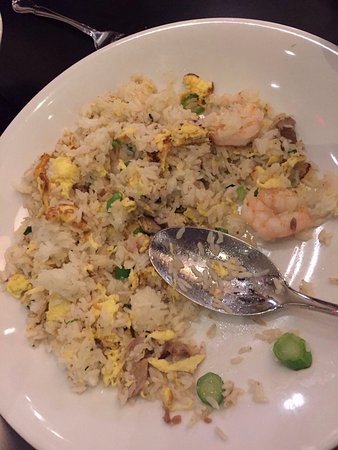
At what (x,y) coordinates should I click in order to perform the action: click on bowl. Please return your answer as a coordinate pair (x, y). The height and width of the screenshot is (450, 338). Looking at the image, I should click on (254, 67).